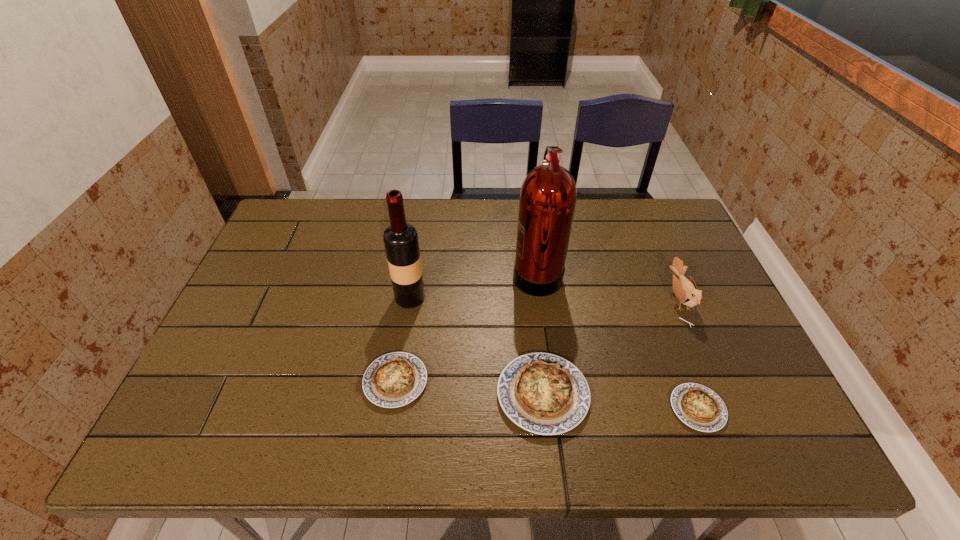
Please point a spot to add another quiche on the left. Please provide its 2D coordinates. Your answer should be formatted as a tuple, i.e. [(x, y)], where the tuple contains the x and y coordinates of a point satisfying the conditions above.

[(255, 369)]